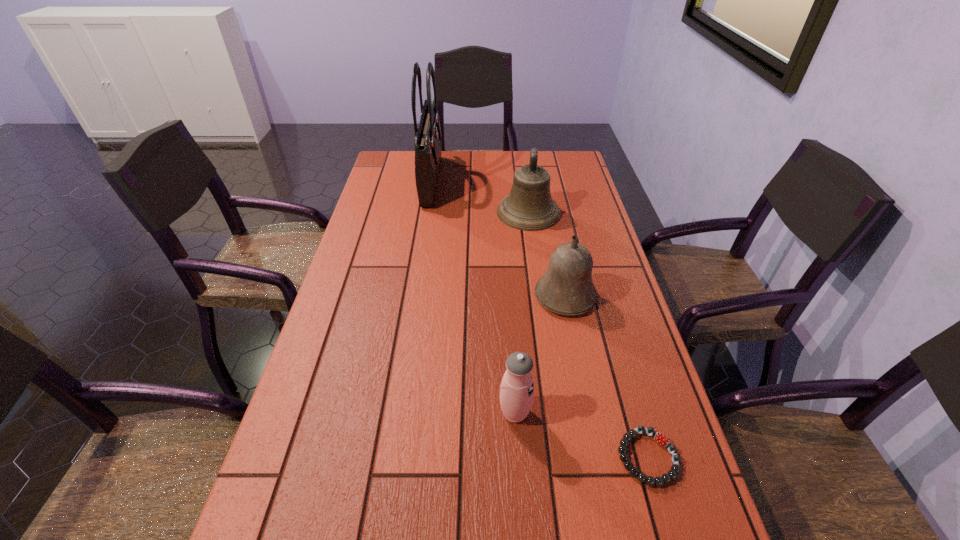
Find the location of a particular element. the tallest object is located at coordinates (428, 139).

Locate an element on the screen. the leftmost object is located at coordinates (428, 139).

This screenshot has width=960, height=540. I want to click on the farther bell, so click(529, 206).

Locate an element on the screen. Image resolution: width=960 pixels, height=540 pixels. the shorter bell is located at coordinates (566, 288).

Identify the location of the nearer bell. (566, 288).

What are the coordinates of `thermos bottle` in the screenshot? It's located at (517, 387).

This screenshot has width=960, height=540. What are the coordinates of `the nearest object` in the screenshot? It's located at (660, 438).

You are a GUI agent. You are given a task and a screenshot of the screen. Output one action in this format:
    pyautogui.click(x=<x>, y=<y>)
    Task: Click on the shortest object
    The width and height of the screenshot is (960, 540).
    Given the screenshot: What is the action you would take?
    pyautogui.click(x=660, y=438)

I want to click on vacant space located with an open clasp on the front of the handbag, so click(x=491, y=180).

Where is `free space located 0.330m on the front of the farther bell`? Image resolution: width=960 pixels, height=540 pixels. free space located 0.330m on the front of the farther bell is located at coordinates 542,306.